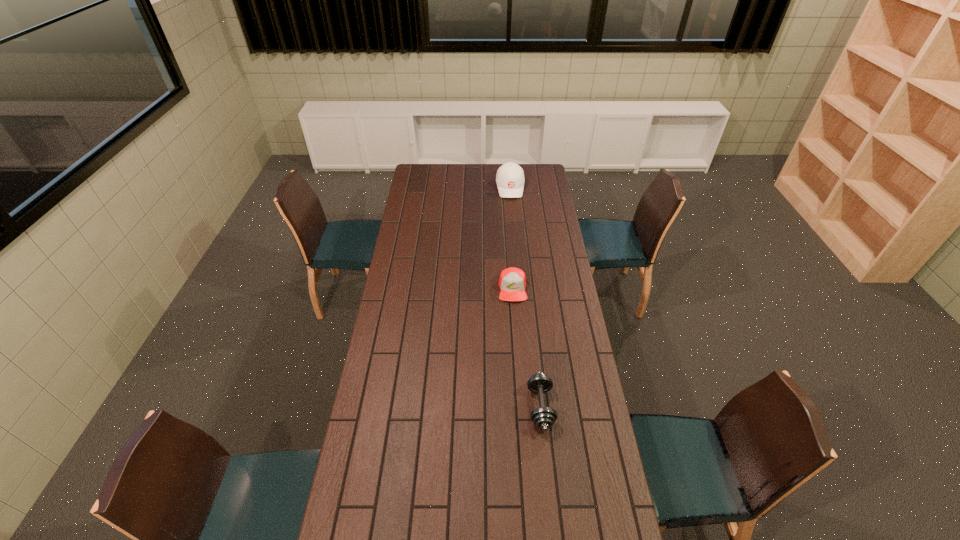
You are a GUI agent. You are given a task and a screenshot of the screen. Output one action in this format:
    pyautogui.click(x=<x>, y=<y>)
    Task: Click on the taller baseball cap
    
    Given the screenshot: What is the action you would take?
    pyautogui.click(x=510, y=179)

Locate an element on the screen. This screenshot has width=960, height=540. the tallest object is located at coordinates [510, 179].

This screenshot has height=540, width=960. What are the coordinates of `dumbbell` in the screenshot? It's located at (543, 417).

The width and height of the screenshot is (960, 540). Identify the location of the second farthest object. (512, 282).

This screenshot has height=540, width=960. Identify the location of the nearer baseball cap. (512, 282).

Where is `free space located 0.380m on the front-facing side of the farthest object`? The image size is (960, 540). free space located 0.380m on the front-facing side of the farthest object is located at coordinates (515, 242).

The height and width of the screenshot is (540, 960). I want to click on vacant space situated 0.070m on the right of the dumbbell, so click(x=573, y=407).

Where is `free region located on the front-facing side of the shorter baseball cap`? The width and height of the screenshot is (960, 540). free region located on the front-facing side of the shorter baseball cap is located at coordinates (517, 358).

Locate an element on the screen. object that is at the far edge is located at coordinates (510, 179).

At what (x,y) coordinates should I click in order to perform the action: click on baseball cap that is at the right edge. Please return your answer as a coordinate pair (x, y). This screenshot has width=960, height=540. Looking at the image, I should click on (510, 179).